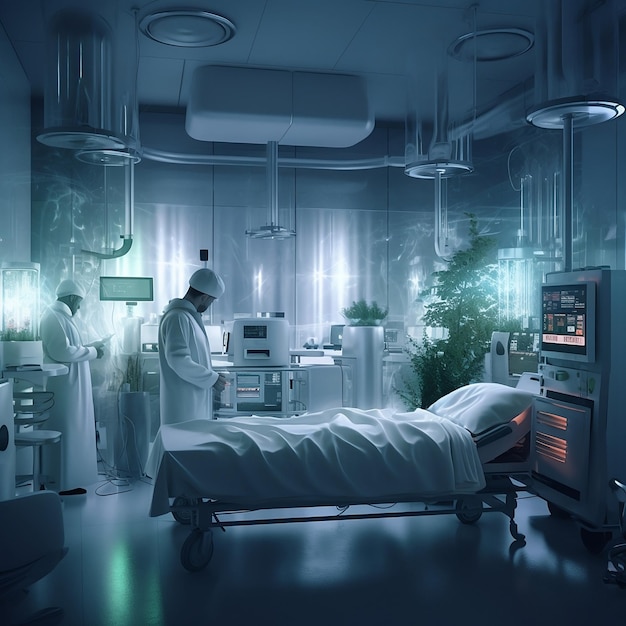
Image resolution: width=626 pixels, height=626 pixels. What are the coordinates of `chair` in the screenshot? It's located at 56,538.